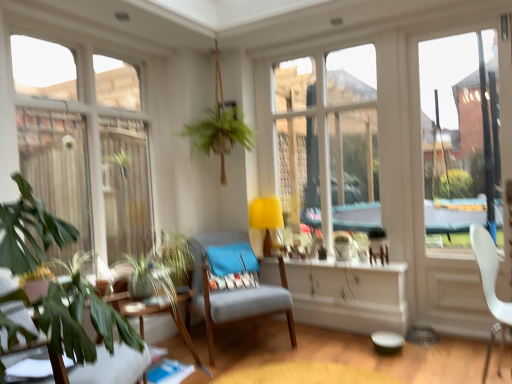
Question: Does green leafy plant at lower left, marked as the 3th chair in a right-to-left arrangement, touch white plastic chair at right, acting as the second chair starting from the front?

Choices:
 (A) no
 (B) yes

Answer: (A)

Question: Does green leafy plant at lower left, marked as the 3th chair in a right-to-left arrangement, turn towards white plastic chair at right, acting as the second chair starting from the front?

Choices:
 (A) yes
 (B) no

Answer: (A)

Question: Is green leafy plant at lower left, which is counted as the 1th chair, starting from the left, bigger than white plastic chair at right, acting as the second chair starting from the front?

Choices:
 (A) no
 (B) yes

Answer: (B)

Question: Considering the relative sizes of green leafy plant at lower left, marked as the 3th chair in a right-to-left arrangement, and white plastic chair at right, which is the 2th chair from back to front, in the image provided, is green leafy plant at lower left, marked as the 3th chair in a right-to-left arrangement, shorter than white plastic chair at right, which is the 2th chair from back to front,?

Choices:
 (A) yes
 (B) no

Answer: (A)

Question: From a real-world perspective, is green leafy plant at lower left, marked as the 1th chair in a front-to-back arrangement, under white plastic chair at right, which is the third chair in left-to-right order?

Choices:
 (A) yes
 (B) no

Answer: (A)

Question: Considering the relative positions of green leafy plant at lower left, marked as the 3th chair in a right-to-left arrangement, and white plastic chair at right, which is the 2th chair from back to front, in the image provided, is green leafy plant at lower left, marked as the 3th chair in a right-to-left arrangement, behind white plastic chair at right, which is the 2th chair from back to front,?

Choices:
 (A) yes
 (B) no

Answer: (B)

Question: Does yellow fabric lampshade at center appear on the left side of wooden table at lower left?

Choices:
 (A) no
 (B) yes

Answer: (A)

Question: Is wooden table at lower left located within yellow fabric lampshade at center?

Choices:
 (A) yes
 (B) no

Answer: (B)

Question: Can you confirm if yellow fabric lampshade at center is taller than wooden table at lower left?

Choices:
 (A) no
 (B) yes

Answer: (B)

Question: Is yellow fabric lampshade at center positioned with its back to wooden table at lower left?

Choices:
 (A) yes
 (B) no

Answer: (B)

Question: Is yellow fabric lampshade at center to the right of wooden table at lower left from the viewer's perspective?

Choices:
 (A) yes
 (B) no

Answer: (A)

Question: Is yellow fabric lampshade at center shorter than wooden table at lower left?

Choices:
 (A) no
 (B) yes

Answer: (A)

Question: Is green leafy plant at lower left thinner than transparent glass window at left?

Choices:
 (A) yes
 (B) no

Answer: (B)